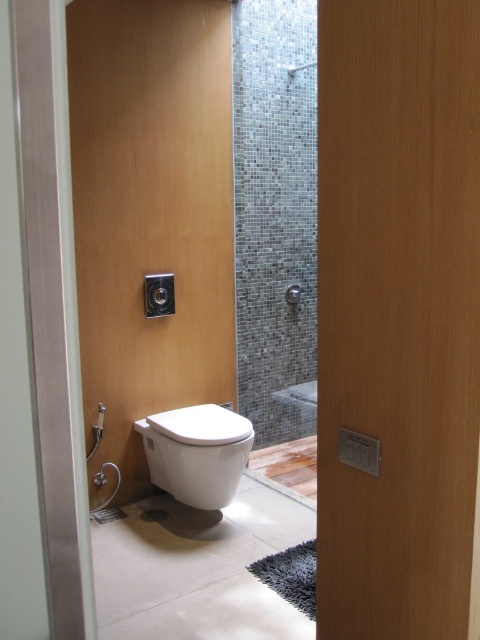
You are standing at the entrance of the bathroom and want to flush the toilet. The flush button is located on the wall above the white glossy toilet at center. Can you reach it without moving closer?

The white glossy toilet at center is 2.71 meters away from the viewer. The flush button is above it, so if the button is within arm reach from that distance, you can reach it. However, typically, 2.71 meters is too far for an average person to reach the flush button without moving closer.